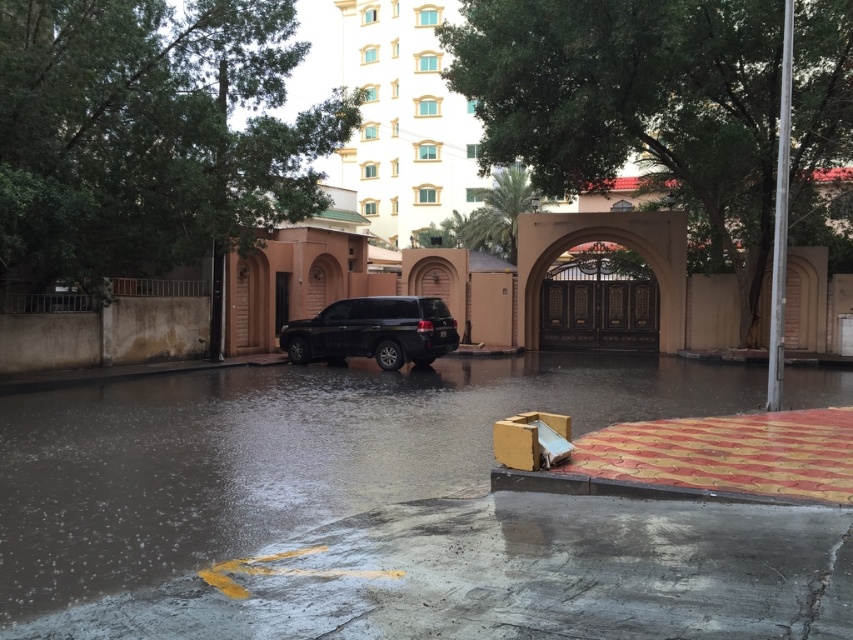
Does white glossy building at upper center have a lesser height compared to brown polished wood archway at center?

In fact, white glossy building at upper center may be taller than brown polished wood archway at center.

Can you confirm if white glossy building at upper center is positioned below brown polished wood archway at center?

Actually, white glossy building at upper center is above brown polished wood archway at center.

This screenshot has height=640, width=853. Describe the element at coordinates (405, 120) in the screenshot. I see `white glossy building at upper center` at that location.

You are a GUI agent. You are given a task and a screenshot of the screen. Output one action in this format:
    pyautogui.click(x=<x>, y=<y>)
    Task: Click on the white glossy building at upper center
    The width and height of the screenshot is (853, 640).
    Given the screenshot: What is the action you would take?
    pyautogui.click(x=405, y=120)

Is glossy concrete flood at center taller than white glossy building at upper center?

No, glossy concrete flood at center is not taller than white glossy building at upper center.

Looking at this image, between glossy concrete flood at center and white glossy building at upper center, which one has more height?

white glossy building at upper center is taller.

Measure the distance between point (447, 525) and camera.

6.08 meters

Locate an element on the screen. The height and width of the screenshot is (640, 853). glossy concrete flood at center is located at coordinates (384, 512).

Is white glossy building at upper center in front of black matte suv at center?

No.

Who is positioned more to the right, white glossy building at upper center or black matte suv at center?

black matte suv at center

Is point (403, 132) in front of point (312, 353)?

No, it is not.

At what (x,y) coordinates should I click in order to perform the action: click on white glossy building at upper center. Please return your answer as a coordinate pair (x, y). The height and width of the screenshot is (640, 853). Looking at the image, I should click on (405, 120).